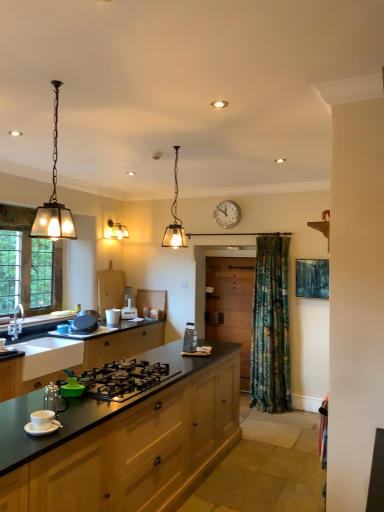
Question: Does white glossy cup at center, which appears as the fourth appliance when viewed from the front, have a lesser height compared to matte black countertop at lower left, the second cabinetry positioned from the front?

Choices:
 (A) no
 (B) yes

Answer: (B)

Question: Is white glossy cup at center, which appears as the fourth appliance when viewed from the front, further to camera compared to matte black countertop at lower left, the second cabinetry positioned from the front?

Choices:
 (A) yes
 (B) no

Answer: (A)

Question: Could matte black countertop at lower left, the second cabinetry positioned from the front, be considered to be inside white glossy cup at center, which appears as the fourth appliance when viewed from the front?

Choices:
 (A) yes
 (B) no

Answer: (B)

Question: Is white glossy cup at center, which appears as the fourth appliance when viewed from the front, to the left of matte black countertop at lower left, the second cabinetry in the back-to-front sequence, from the viewer's perspective?

Choices:
 (A) no
 (B) yes

Answer: (A)

Question: Is the depth of white glossy cup at center, which ranks as the 4th appliance in right-to-left order, less than that of matte black countertop at lower left, the second cabinetry in the back-to-front sequence?

Choices:
 (A) no
 (B) yes

Answer: (A)

Question: From a real-world perspective, relative to matte black countertop at lower left, the 1th cabinetry positioned from the front, is white glossy cup at center, the 2th appliance in the back-to-front sequence, vertically above or below?

Choices:
 (A) below
 (B) above

Answer: (B)

Question: From the image's perspective, relative to matte black countertop at lower left, the 1th cabinetry positioned from the front, is white glossy cup at center, which ranks as the 4th appliance in right-to-left order, above or below?

Choices:
 (A) above
 (B) below

Answer: (A)

Question: Considering the positions of white glossy cup at center, placed as the second appliance when sorted from left to right, and matte black countertop at lower left, the 3th cabinetry in the back-to-front sequence, in the image, is white glossy cup at center, placed as the second appliance when sorted from left to right, bigger or smaller than matte black countertop at lower left, the 3th cabinetry in the back-to-front sequence,?

Choices:
 (A) small
 (B) big

Answer: (A)

Question: Considering the positions of white glossy cup at center, which appears as the fourth appliance when viewed from the front, and matte black countertop at lower left, the 3th cabinetry in the back-to-front sequence, in the image, is white glossy cup at center, which appears as the fourth appliance when viewed from the front, taller or shorter than matte black countertop at lower left, the 3th cabinetry in the back-to-front sequence,?

Choices:
 (A) tall
 (B) short

Answer: (B)

Question: Is point (228, 215) closer or farther from the camera than point (4, 435)?

Choices:
 (A) closer
 (B) farther

Answer: (B)

Question: Is white plastic clock at upper center inside or outside of matte black countertop at lower left, the 3th cabinetry in the back-to-front sequence?

Choices:
 (A) inside
 (B) outside

Answer: (B)

Question: In terms of height, does white plastic clock at upper center look taller or shorter compared to matte black countertop at lower left, the 1th cabinetry positioned from the front?

Choices:
 (A) short
 (B) tall

Answer: (A)

Question: Based on their positions, is white plastic clock at upper center located to the left or right of matte black countertop at lower left, the 1th cabinetry positioned from the front?

Choices:
 (A) left
 (B) right

Answer: (B)

Question: In terms of size, does brushed metal faucet at left appear bigger or smaller than wooden cabinet at center, positioned as the 3th cabinetry in front-to-back order?

Choices:
 (A) big
 (B) small

Answer: (B)

Question: Choose the correct answer: Is brushed metal faucet at left inside wooden cabinet at center, positioned as the 3th cabinetry in front-to-back order, or outside it?

Choices:
 (A) outside
 (B) inside

Answer: (A)